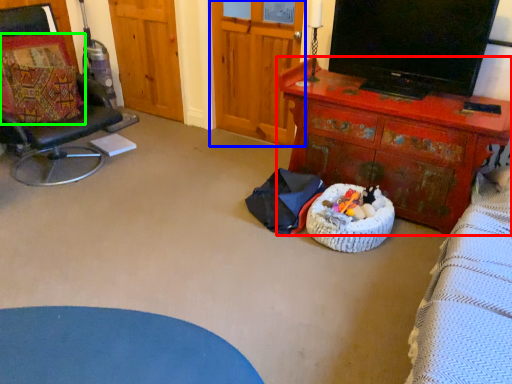
Question: Which is farther away from desk (highlighted by a red box)? armoire (highlighted by a blue box) or pillow (highlighted by a green box)?

Choices:
 (A) armoire
 (B) pillow

Answer: (B)